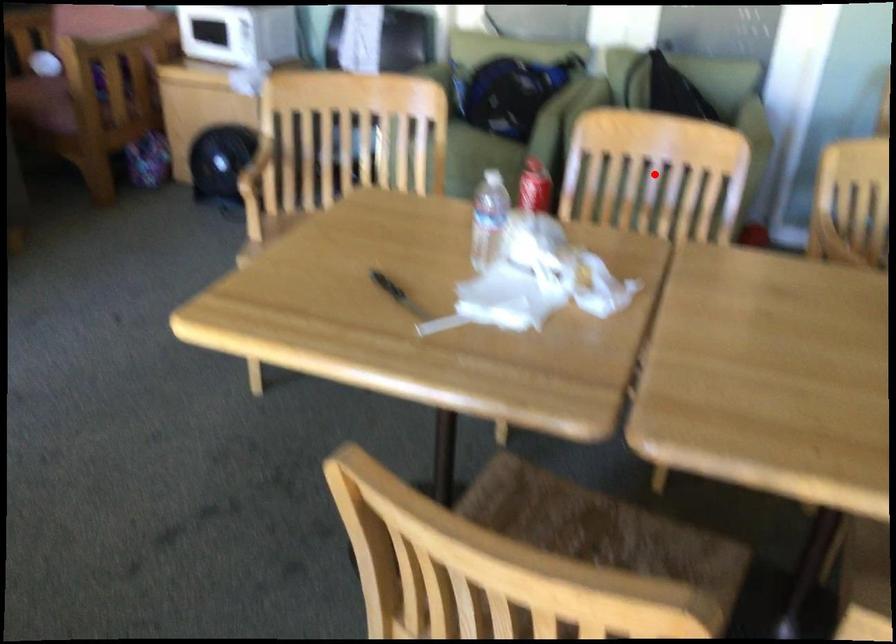
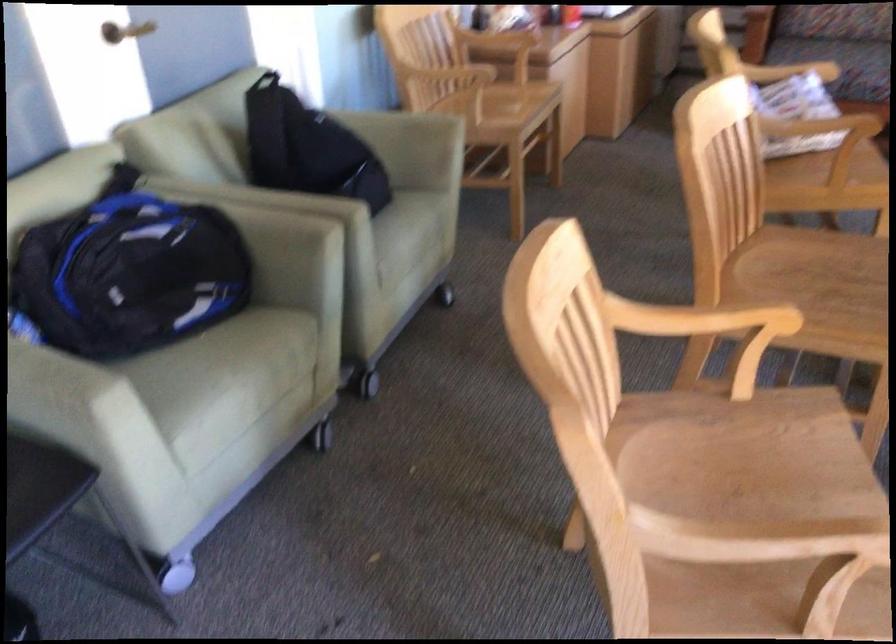
Question: I am providing you with two images of the same scene from different viewpoints. A red point is marked on the first image. Can you still see the location of the red point in image 2?

Choices:
 (A) Yes
 (B) No

Answer: (B)